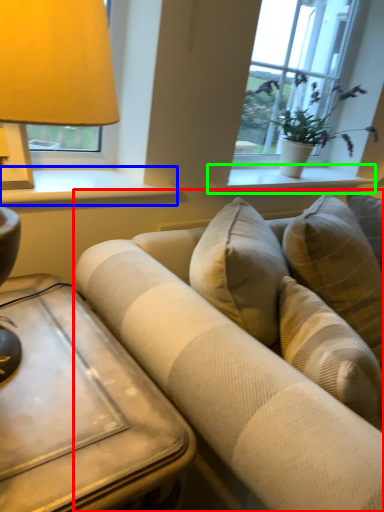
Question: Estimate the real-world distances between objects in this image. Which object is closer to studio couch (highlighted by a red box), window sill (highlighted by a blue box) or window sill (highlighted by a green box)?

Choices:
 (A) window sill
 (B) window sill

Answer: (A)